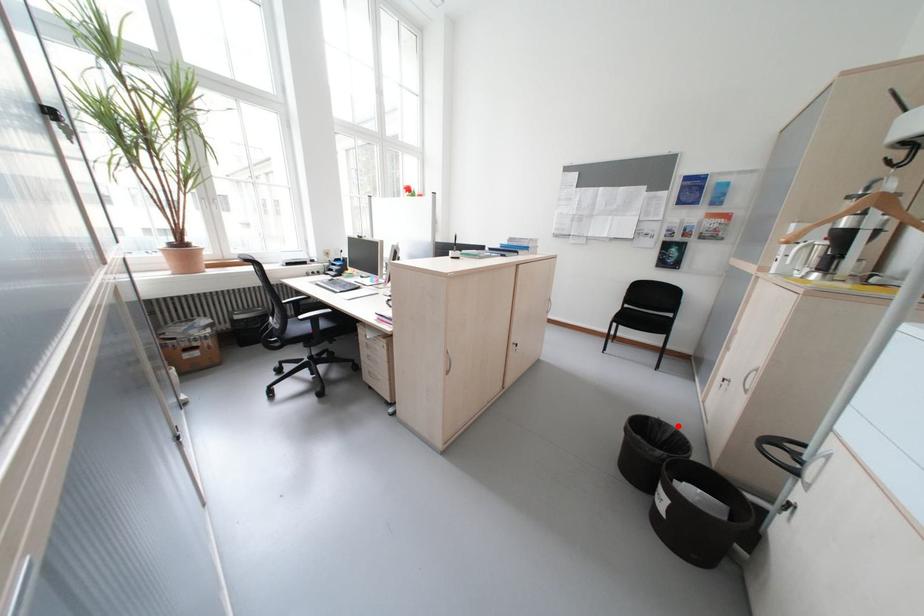
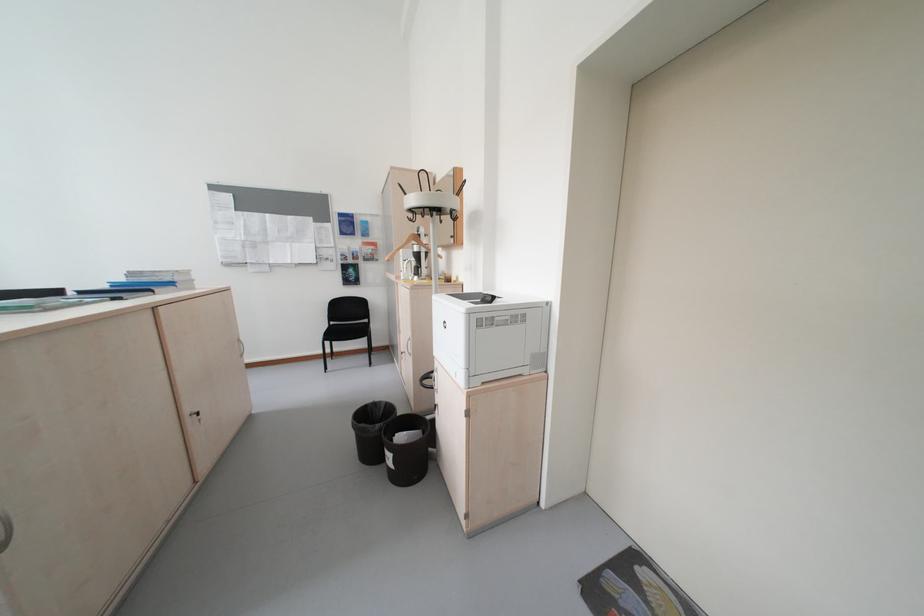
In the second image, find the point that corresponds to the highlighted location in the first image.

(391, 403)